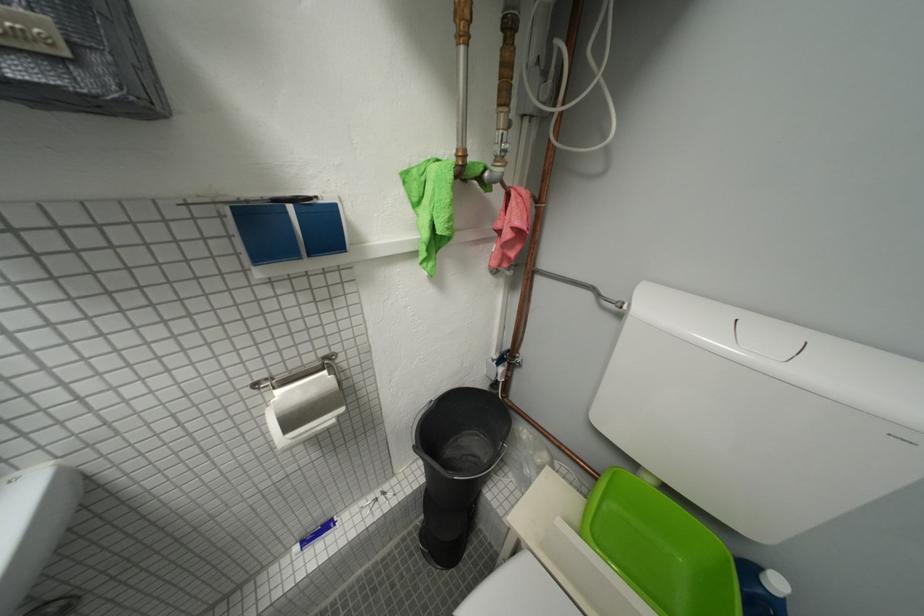
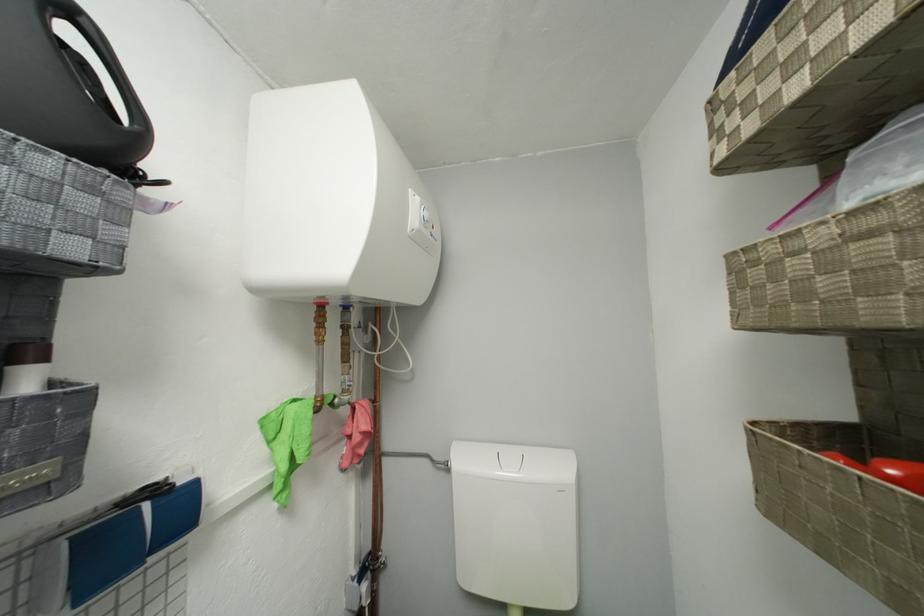
Find the pixel in the second image that matches the point at 299,209 in the first image.

(155, 508)